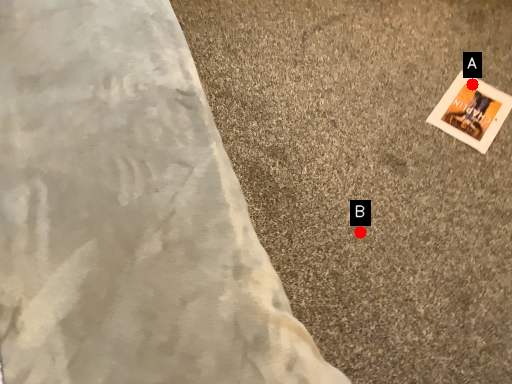
Question: Two points are circled on the image, labeled by A and B beside each circle. Which of the following is the closest to the observer?

Choices:
 (A) A is closer
 (B) B is closer

Answer: (B)